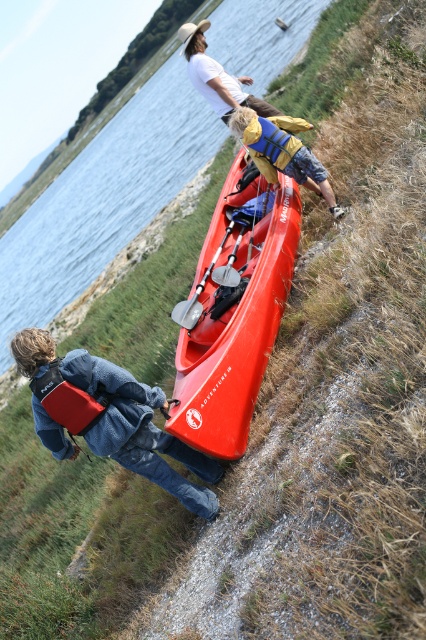
Question: Which point is farther to the camera?

Choices:
 (A) white cotton shirt at upper center
 (B) glossy plastic kayak at upper center
 (C) shiny red canoe at center
 (D) yellow life vest at center

Answer: (B)

Question: Is silver metallic paddle at center smaller than brushed metal paddle at center?

Choices:
 (A) no
 (B) yes

Answer: (A)

Question: Which object is positioned closest to the brushed metal paddle at center?

Choices:
 (A) glossy plastic kayak at upper center
 (B) yellowmateriallife jacket at center

Answer: (B)

Question: Which of the following is the closest to the observer?

Choices:
 (A) (17, 365)
 (B) (209, 435)

Answer: (A)

Question: Can you confirm if yellowmateriallife jacket at center is wider than silver metallic paddle at center?

Choices:
 (A) yes
 (B) no

Answer: (A)

Question: Does white cotton shirt at upper center have a larger size compared to yellowmateriallife jacket at center?

Choices:
 (A) yes
 (B) no

Answer: (A)